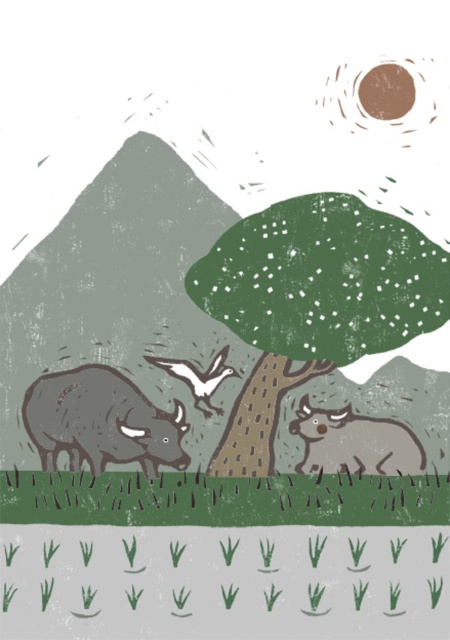
Between point (196, 500) and point (323, 413), which one is positioned behind?

The point (323, 413) is behind.

The width and height of the screenshot is (450, 640). What do you see at coordinates (221, 499) in the screenshot? I see `green textured grass at lower center` at bounding box center [221, 499].

Find the location of a particular element. Image resolution: width=450 pixels, height=640 pixels. green textured grass at lower center is located at coordinates (221, 499).

The image size is (450, 640). Find the location of `green textured grass at lower center`. green textured grass at lower center is located at coordinates tap(221, 499).

Is point (446, 275) positioned in front of point (40, 388)?

No, (446, 275) is behind (40, 388).

Is green textured tree at center positioned in front of gray textured cow at center?

That is False.

Between point (444, 320) and point (31, 394), which one is positioned in front?

Point (31, 394)

Image resolution: width=450 pixels, height=640 pixels. Identify the location of green textured tree at center. 248,308.

Based on the photo, is green textured grass at lower center taller than white matte bird at center?

No, green textured grass at lower center is not taller than white matte bird at center.

Can you confirm if green textured grass at lower center is wider than white matte bird at center?

Indeed, green textured grass at lower center has a greater width compared to white matte bird at center.

At what (x,y) coordinates should I click in order to perform the action: click on green textured grass at lower center. Please return your answer as a coordinate pair (x, y). Looking at the image, I should click on (221, 499).